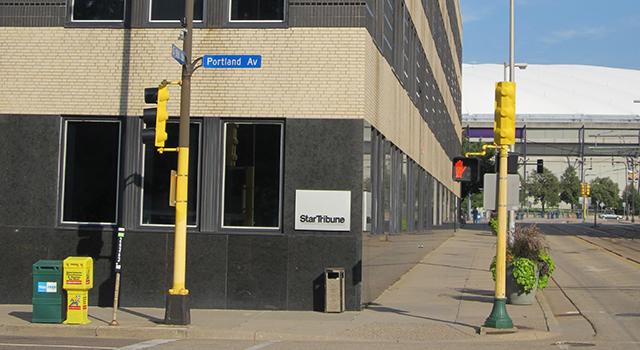
The image size is (640, 350). Find the location of `round white roof`. round white roof is located at coordinates (566, 95).